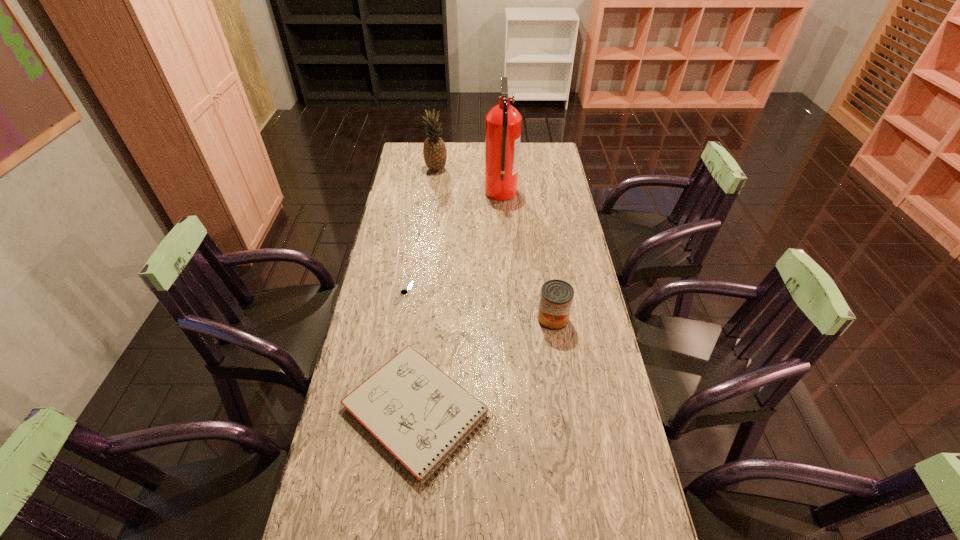
Identify the location of fire extinguisher. (503, 122).

Where is `the fourth nearest object`? the fourth nearest object is located at coordinates (503, 122).

Identify the location of the farthest object. (434, 150).

This screenshot has width=960, height=540. Find the location of `the second tallest object`. the second tallest object is located at coordinates (434, 150).

Locate an element on the screen. This screenshot has height=540, width=960. the third tallest object is located at coordinates (556, 297).

What are the coordinates of `the rightmost object` in the screenshot? It's located at (556, 297).

Where is `notepad`? notepad is located at coordinates (420, 415).

At what (x,y) coordinates should I click in order to perform the action: click on the nearest object. Please return your answer as a coordinate pair (x, y). Image resolution: width=960 pixels, height=540 pixels. Looking at the image, I should click on (420, 415).

Locate an element on the screen. the shortest object is located at coordinates (404, 292).

In order to click on the third nearest object in this screenshot , I will do tap(404, 292).